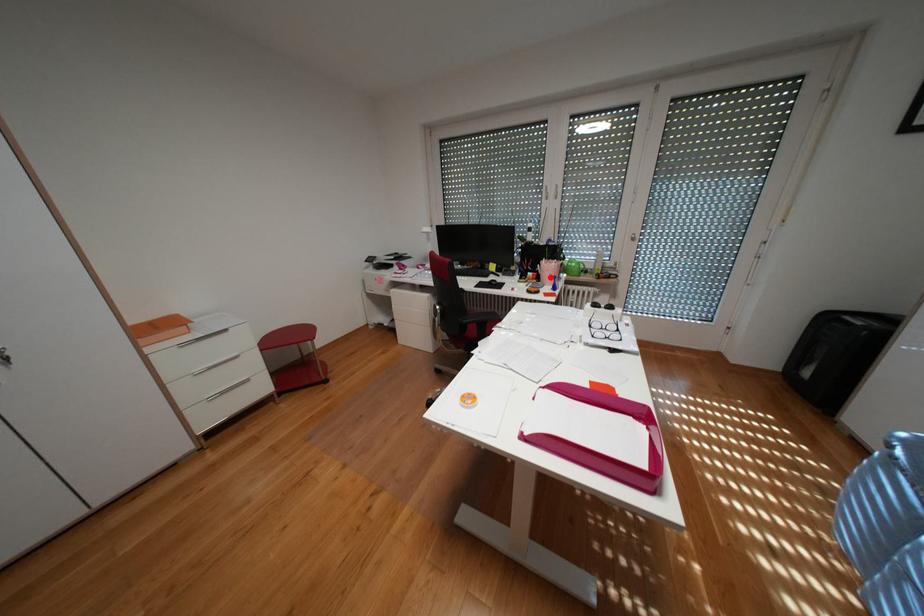
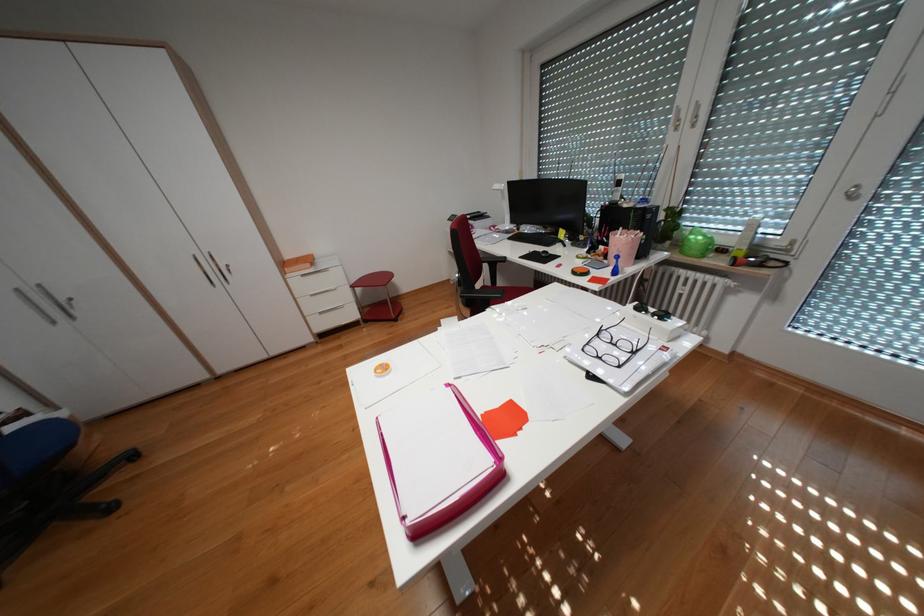
Locate, in the second image, the point that corresponds to the highlighted location in the first image.

(618, 254)